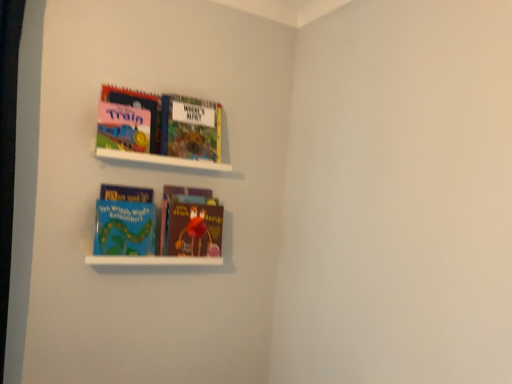
This screenshot has width=512, height=384. Describe the element at coordinates (128, 120) in the screenshot. I see `matte pink board book at upper left, the 4th book positioned from the bottom` at that location.

This screenshot has height=384, width=512. What do you see at coordinates (190, 222) in the screenshot?
I see `brown matte book at center, acting as the 4th book starting from the top` at bounding box center [190, 222].

You are a GUI agent. You are given a task and a screenshot of the screen. Output one action in this format:
    pyautogui.click(x=<x>, y=<y>)
    Task: Click on the blue matte book at lower left, which appears as the second book when ordered from the bottom
    
    Given the screenshot: What is the action you would take?
    pyautogui.click(x=124, y=221)

What is the approximate width of blue matte book at lower left, which appears as the second book when ordered from the bottom?

11.83 centimeters.

Find the location of a particular element. white matte shelf at lower center, positioned as the second cabinet in top-to-bottom order is located at coordinates pyautogui.click(x=152, y=260).

Locate an element on the screen. white matte bookshelf at upper center, the first cabinet from the top is located at coordinates (161, 160).

Find the location of a particular element. matte pink board book at upper left, the 4th book positioned from the bottom is located at coordinates 128,120.

From the image's perspective, relative to matte pink board book at upper left, the 4th book positioned from the bottom, is brown matte book at center, placed as the first book when sorted from bottom to top, above or below?

Clearly, from the image's perspective, brown matte book at center, placed as the first book when sorted from bottom to top, is below matte pink board book at upper left, the 4th book positioned from the bottom.

From a real-world perspective, relative to matte pink board book at upper left, the 1th book positioned from the top, is brown matte book at center, acting as the 4th book starting from the top, vertically above or below?

brown matte book at center, acting as the 4th book starting from the top, is below matte pink board book at upper left, the 1th book positioned from the top.

Considering the sizes of objects brown matte book at center, acting as the 4th book starting from the top, and matte pink board book at upper left, the 4th book positioned from the bottom, in the image provided, who is taller, brown matte book at center, acting as the 4th book starting from the top, or matte pink board book at upper left, the 4th book positioned from the bottom,?

brown matte book at center, acting as the 4th book starting from the top, is taller.

Could matte pink board book at upper left, the 1th book positioned from the top, be considered to be inside brown matte book at center, acting as the 4th book starting from the top?

No, matte pink board book at upper left, the 1th book positioned from the top, is located outside of brown matte book at center, acting as the 4th book starting from the top.

Considering the sizes of hardcover book at upper center, the 2th book viewed from the top, and matte pink board book at upper left, the 4th book positioned from the bottom, in the image, is hardcover book at upper center, the 2th book viewed from the top, bigger or smaller than matte pink board book at upper left, the 4th book positioned from the bottom,?

hardcover book at upper center, the 2th book viewed from the top, is bigger than matte pink board book at upper left, the 4th book positioned from the bottom.

Does hardcover book at upper center, the 2th book viewed from the top, lie behind matte pink board book at upper left, the 1th book positioned from the top?

Yes, it is behind matte pink board book at upper left, the 1th book positioned from the top.

Is the surface of hardcover book at upper center, the 3th book from the bottom, in direct contact with matte pink board book at upper left, the 4th book positioned from the bottom?

hardcover book at upper center, the 3th book from the bottom, and matte pink board book at upper left, the 4th book positioned from the bottom, are not in contact.

Image resolution: width=512 pixels, height=384 pixels. In the image, there is a blue matte book at lower left, the third book from the top. Find the location of `cabinet below it (from a real-world perspective)`. cabinet below it (from a real-world perspective) is located at coordinates (152, 260).

Does white matte shelf at lower center, placed as the 1th cabinet when sorted from bottom to top, have a lesser height compared to blue matte book at lower left, which appears as the second book when ordered from the bottom?

Indeed, white matte shelf at lower center, placed as the 1th cabinet when sorted from bottom to top, has a lesser height compared to blue matte book at lower left, which appears as the second book when ordered from the bottom.

Considering the relative positions of white matte shelf at lower center, positioned as the second cabinet in top-to-bottom order, and blue matte book at lower left, the third book from the top, in the image provided, is white matte shelf at lower center, positioned as the second cabinet in top-to-bottom order, to the right of blue matte book at lower left, the third book from the top, from the viewer's perspective?

Yes.

How much distance is there between white matte shelf at lower center, positioned as the second cabinet in top-to-bottom order, and blue matte book at lower left, the third book from the top?

The distance of white matte shelf at lower center, positioned as the second cabinet in top-to-bottom order, from blue matte book at lower left, the third book from the top, is 4.98 inches.

Is white matte bookshelf at upper center, the first cabinet from the top, not inside white matte shelf at lower center, placed as the 1th cabinet when sorted from bottom to top?

Yes.

Can you confirm if white matte bookshelf at upper center, the first cabinet from the top, is positioned to the left of white matte shelf at lower center, placed as the 1th cabinet when sorted from bottom to top?

In fact, white matte bookshelf at upper center, the first cabinet from the top, is to the right of white matte shelf at lower center, placed as the 1th cabinet when sorted from bottom to top.

Is white matte bookshelf at upper center, the first cabinet from the top, bigger than white matte shelf at lower center, positioned as the second cabinet in top-to-bottom order?

Incorrect, white matte bookshelf at upper center, the first cabinet from the top, is not larger than white matte shelf at lower center, positioned as the second cabinet in top-to-bottom order.

Which object is closer to the camera taking this photo, white matte bookshelf at upper center, the first cabinet from the top, or white matte shelf at lower center, positioned as the second cabinet in top-to-bottom order?

white matte shelf at lower center, positioned as the second cabinet in top-to-bottom order, is more forward.

Is blue matte book at lower left, which appears as the second book when ordered from the bottom, oriented away from hardcover book at upper center, the 3th book from the bottom?

No, hardcover book at upper center, the 3th book from the bottom, is not at the back of blue matte book at lower left, which appears as the second book when ordered from the bottom.

Between blue matte book at lower left, which appears as the second book when ordered from the bottom, and hardcover book at upper center, the 3th book from the bottom, which one has less height?

Answer: With less height is blue matte book at lower left, which appears as the second book when ordered from the bottom.

Which is more to the right, blue matte book at lower left, the third book from the top, or hardcover book at upper center, the 3th book from the bottom?

Positioned to the right is hardcover book at upper center, the 3th book from the bottom.

Would you say blue matte book at lower left, the third book from the top, is outside hardcover book at upper center, the 2th book viewed from the top?

Yes.

Could you tell me if hardcover book at upper center, the 2th book viewed from the top, is turned towards white matte shelf at lower center, positioned as the second cabinet in top-to-bottom order?

No, hardcover book at upper center, the 2th book viewed from the top, does not turn towards white matte shelf at lower center, positioned as the second cabinet in top-to-bottom order.

Based on their positions, is hardcover book at upper center, the 2th book viewed from the top, located to the left or right of white matte shelf at lower center, placed as the 1th cabinet when sorted from bottom to top?

From the image, it's evident that hardcover book at upper center, the 2th book viewed from the top, is to the right of white matte shelf at lower center, placed as the 1th cabinet when sorted from bottom to top.

Can you confirm if hardcover book at upper center, the 2th book viewed from the top, is smaller than white matte shelf at lower center, positioned as the second cabinet in top-to-bottom order?

No.

From a real-world perspective, is white matte bookshelf at upper center, the first cabinet from the top, under blue matte book at lower left, the third book from the top?

No, from a real-world perspective, white matte bookshelf at upper center, the first cabinet from the top, is not under blue matte book at lower left, the third book from the top.

Between white matte bookshelf at upper center, the first cabinet from the top, and blue matte book at lower left, which appears as the second book when ordered from the bottom, which one has larger size?

blue matte book at lower left, which appears as the second book when ordered from the bottom, is bigger.

Is point (196, 163) less distant than point (136, 234)?

No, (196, 163) is behind (136, 234).

From the image's perspective, which one is positioned lower, white matte bookshelf at upper center, the first cabinet from the top, or blue matte book at lower left, the third book from the top?

blue matte book at lower left, the third book from the top, is shown below in the image.

This screenshot has width=512, height=384. What are the coordinates of `the 1st book to the left when counting from the brown matte book at center, acting as the 4th book starting from the top` in the screenshot? It's located at (128, 120).

Find the location of `the 1st book below the hardcover book at upper center, the 3th book from the bottom (from a real-world perspective)`. the 1st book below the hardcover book at upper center, the 3th book from the bottom (from a real-world perspective) is located at coordinates (128, 120).

Based on their spatial positions, is white matte shelf at lower center, positioned as the second cabinet in top-to-bottom order, or brown matte book at center, placed as the first book when sorted from bottom to top, further from white matte bookshelf at upper center, the first cabinet from the top?

Based on the image, white matte shelf at lower center, positioned as the second cabinet in top-to-bottom order, appears to be further to white matte bookshelf at upper center, the first cabinet from the top.

Estimate the real-world distances between objects in this image. Which object is further from white matte bookshelf at upper center, placed as the 2th cabinet when sorted from bottom to top, blue matte book at lower left, which appears as the second book when ordered from the bottom, or matte pink board book at upper left, the 1th book positioned from the top?

The object further to white matte bookshelf at upper center, placed as the 2th cabinet when sorted from bottom to top, is blue matte book at lower left, which appears as the second book when ordered from the bottom.

From the image, which object appears to be farther from matte pink board book at upper left, the 4th book positioned from the bottom, brown matte book at center, acting as the 4th book starting from the top, or hardcover book at upper center, the 3th book from the bottom?

Among the two, brown matte book at center, acting as the 4th book starting from the top, is located further to matte pink board book at upper left, the 4th book positioned from the bottom.

From the image, which object appears to be farther from blue matte book at lower left, the third book from the top, hardcover book at upper center, the 3th book from the bottom, or brown matte book at center, acting as the 4th book starting from the top?

The object further to blue matte book at lower left, the third book from the top, is hardcover book at upper center, the 3th book from the bottom.

Estimate the real-world distances between objects in this image. Which object is closer to brown matte book at center, acting as the 4th book starting from the top, white matte bookshelf at upper center, the first cabinet from the top, or white matte shelf at lower center, positioned as the second cabinet in top-to-bottom order?

white matte shelf at lower center, positioned as the second cabinet in top-to-bottom order, is positioned closer to the anchor brown matte book at center, acting as the 4th book starting from the top.

Based on their spatial positions, is blue matte book at lower left, which appears as the second book when ordered from the bottom, or white matte bookshelf at upper center, placed as the 2th cabinet when sorted from bottom to top, closer to brown matte book at center, placed as the first book when sorted from bottom to top?

blue matte book at lower left, which appears as the second book when ordered from the bottom, lies closer to brown matte book at center, placed as the first book when sorted from bottom to top, than the other object.

Considering their positions, is white matte shelf at lower center, positioned as the second cabinet in top-to-bottom order, positioned closer to matte pink board book at upper left, the 4th book positioned from the bottom, than brown matte book at center, placed as the first book when sorted from bottom to top?

brown matte book at center, placed as the first book when sorted from bottom to top, is positioned closer to the anchor matte pink board book at upper left, the 4th book positioned from the bottom.

When comparing their distances from matte pink board book at upper left, the 1th book positioned from the top, does brown matte book at center, acting as the 4th book starting from the top, or white matte shelf at lower center, placed as the 1th cabinet when sorted from bottom to top, seem further?

The object further to matte pink board book at upper left, the 1th book positioned from the top, is white matte shelf at lower center, placed as the 1th cabinet when sorted from bottom to top.

Identify the location of cabinet between matte pink board book at upper left, the 1th book positioned from the top, and white matte shelf at lower center, positioned as the second cabinet in top-to-bottom order, vertically. The width and height of the screenshot is (512, 384). (161, 160).

I want to click on cabinet between hardcover book at upper center, the 3th book from the bottom, and blue matte book at lower left, the third book from the top, in the vertical direction, so click(x=161, y=160).

What are the coordinates of `book between hardcover book at upper center, the 3th book from the bottom, and brown matte book at center, acting as the 4th book starting from the top, vertically` in the screenshot? It's located at (124, 221).

Find the location of `cabinet between hardcover book at upper center, the 3th book from the bottom, and brown matte book at center, placed as the first book when sorted from bottom to top, vertically`. cabinet between hardcover book at upper center, the 3th book from the bottom, and brown matte book at center, placed as the first book when sorted from bottom to top, vertically is located at coordinates tap(161, 160).